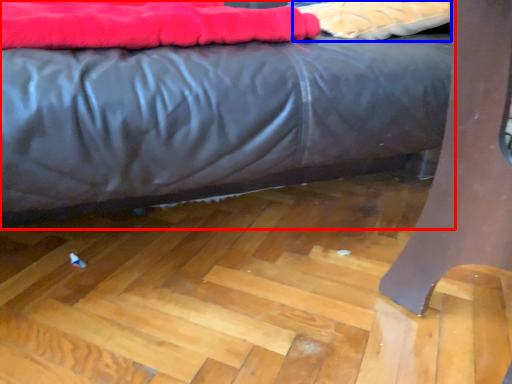
Question: Which of the following is the closest to the observer, bed (highlighted by a red box) or material (highlighted by a blue box)?

Choices:
 (A) bed
 (B) material

Answer: (A)